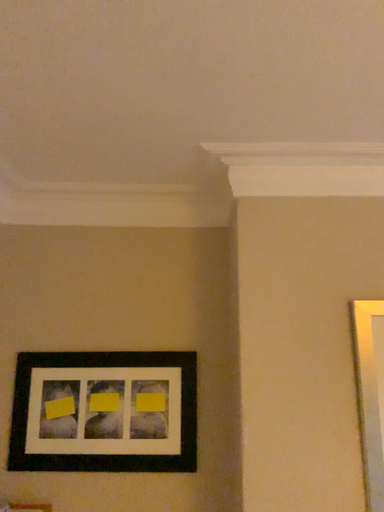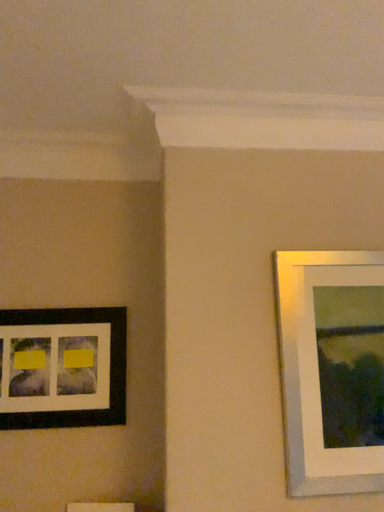
Question: Which way did the camera rotate in the video?

Choices:
 (A) rotated left
 (B) rotated right

Answer: (B)